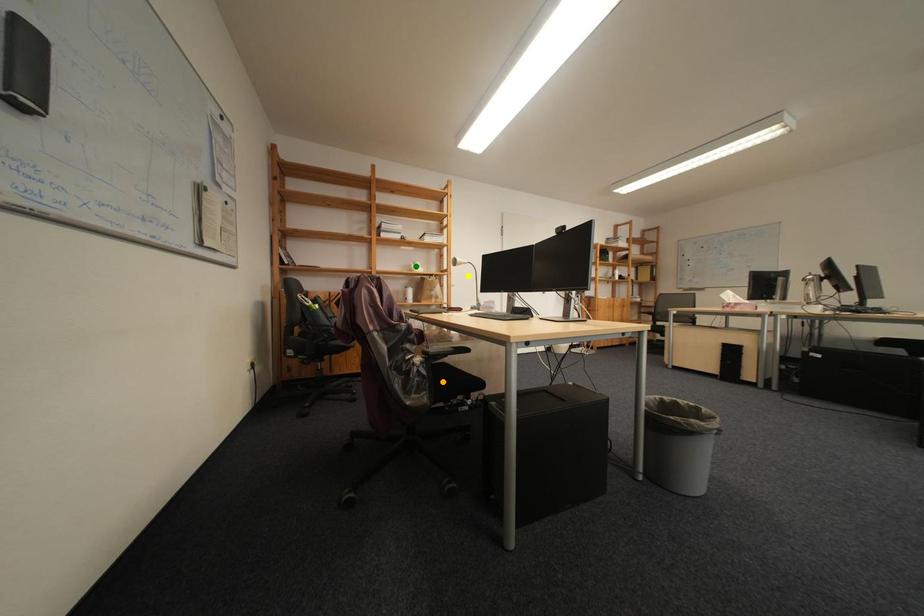
Order these from nearest to farthest:
A) green point
B) yellow point
C) orange point

orange point < yellow point < green point